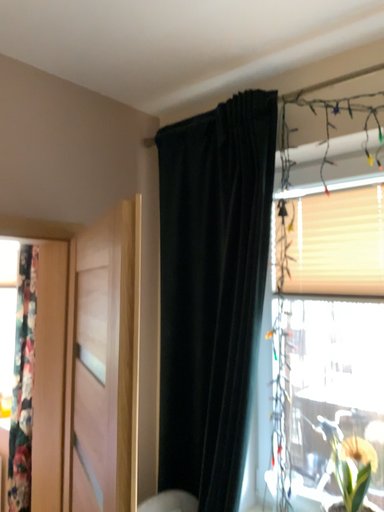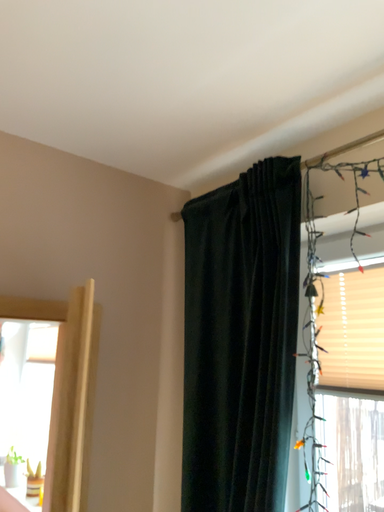
Question: Which way did the camera rotate in the video?

Choices:
 (A) rotated downward
 (B) rotated upward

Answer: (B)